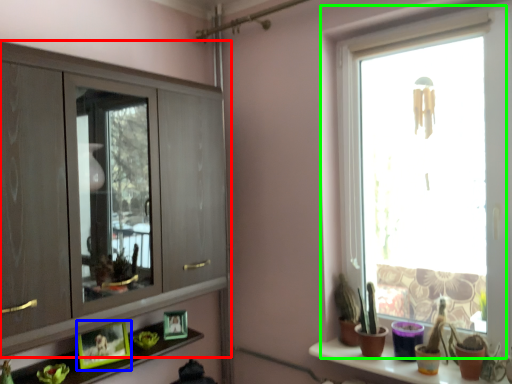
Question: Which is nearer to the cupboard (highlighted by a red box)? picture frame (highlighted by a blue box) or window (highlighted by a green box).

Choices:
 (A) picture frame
 (B) window

Answer: (A)